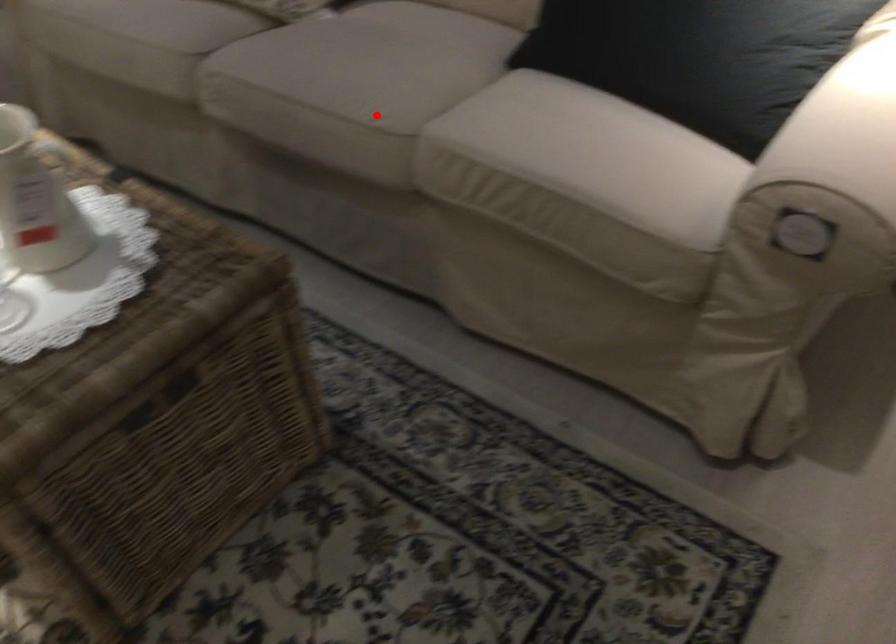
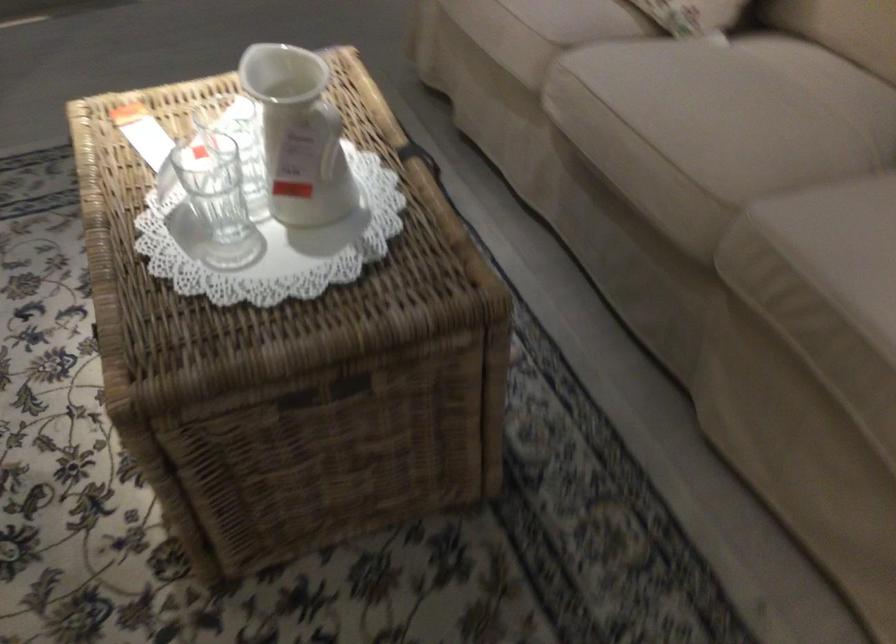
Where in the second image is the point corresponding to the highlighted location from the first image?

(704, 167)